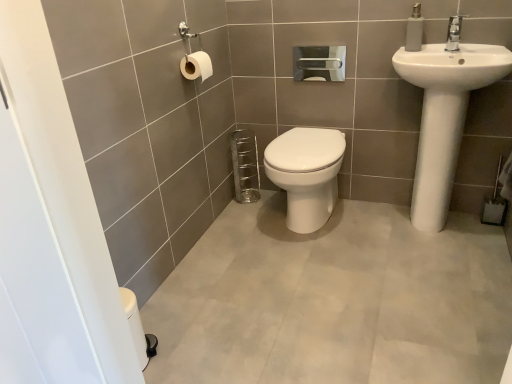
Question: Does white ceramic faucet at upper right turn towards white matte soap dispenser at upper right?

Choices:
 (A) yes
 (B) no

Answer: (B)

Question: Can you confirm if white ceramic faucet at upper right is thinner than white matte soap dispenser at upper right?

Choices:
 (A) no
 (B) yes

Answer: (A)

Question: Is white ceramic faucet at upper right smaller than white matte soap dispenser at upper right?

Choices:
 (A) no
 (B) yes

Answer: (B)

Question: From a real-world perspective, is white ceramic faucet at upper right on top of white matte soap dispenser at upper right?

Choices:
 (A) yes
 (B) no

Answer: (B)

Question: Considering the relative positions of white ceramic faucet at upper right and white matte soap dispenser at upper right in the image provided, is white ceramic faucet at upper right behind white matte soap dispenser at upper right?

Choices:
 (A) yes
 (B) no

Answer: (B)

Question: In the image, is white matte toilet paper at upper left, the 2th toilet paper in the right-to-left sequence, positioned in front of or behind white ceramic faucet at upper right?

Choices:
 (A) front
 (B) behind

Answer: (B)

Question: Would you say white matte toilet paper at upper left, the 2th toilet paper in the right-to-left sequence, is inside or outside white ceramic faucet at upper right?

Choices:
 (A) outside
 (B) inside

Answer: (A)

Question: Does point coord(183,61) appear closer or farther from the camera than point coord(451,44)?

Choices:
 (A) closer
 (B) farther

Answer: (B)

Question: Looking at the image, does white matte toilet paper at upper left, acting as the 2th toilet paper starting from the back, seem bigger or smaller compared to white ceramic faucet at upper right?

Choices:
 (A) small
 (B) big

Answer: (B)

Question: Looking at the image, does white glossy toilet at center seem bigger or smaller compared to white ceramic faucet at upper right?

Choices:
 (A) big
 (B) small

Answer: (A)

Question: From the image's perspective, is white glossy toilet at center located above or below white ceramic faucet at upper right?

Choices:
 (A) above
 (B) below

Answer: (B)

Question: Relative to white ceramic faucet at upper right, is white glossy toilet at center in front or behind?

Choices:
 (A) front
 (B) behind

Answer: (B)

Question: From a real-world perspective, is white glossy toilet at center positioned above or below white ceramic faucet at upper right?

Choices:
 (A) above
 (B) below

Answer: (B)

Question: In terms of width, does white glossy toilet at center look wider or thinner when compared to white glossy toilet paper at upper center, which is the 1th toilet paper in back-to-front order?

Choices:
 (A) thin
 (B) wide

Answer: (B)

Question: From the image's perspective, is white glossy toilet at center located above or below white glossy toilet paper at upper center, the second toilet paper from the left?

Choices:
 (A) below
 (B) above

Answer: (A)